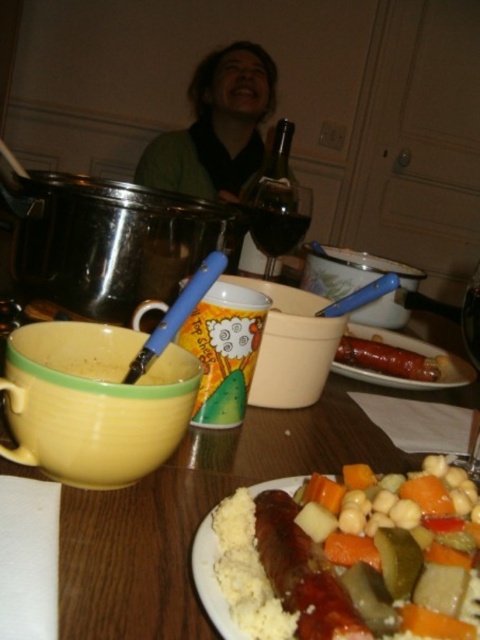
Does point (276, 209) come closer to viewer compared to point (218, 609)?

No, (276, 209) is behind (218, 609).

Consider the image. Is transparent glass wine glass at center above matte white plate with mixed vegetables and sausage at center?

Yes.

Does point (269, 212) come farther from viewer compared to point (210, 609)?

Yes, it is.

Identify the location of transparent glass wine glass at center. (278, 218).

Does green matte shirt at upper center have a greater width compared to dark glass wine at center?

Yes.

Between point (240, 125) and point (283, 225), which one is positioned behind?

The point (240, 125) is behind.

The width and height of the screenshot is (480, 640). What are the coordinates of `green matte shirt at upper center` in the screenshot? It's located at (216, 128).

Is point (455, 355) positioned behind point (266, 243)?

No.

Between sausage and vegetables at center and dark glass wine at center, which one has more height?

With more height is sausage and vegetables at center.

Does point (455, 378) come farther from viewer compared to point (282, 216)?

No, it is not.

In order to click on sausage and vegetables at center in this screenshot , I will do `click(406, 349)`.